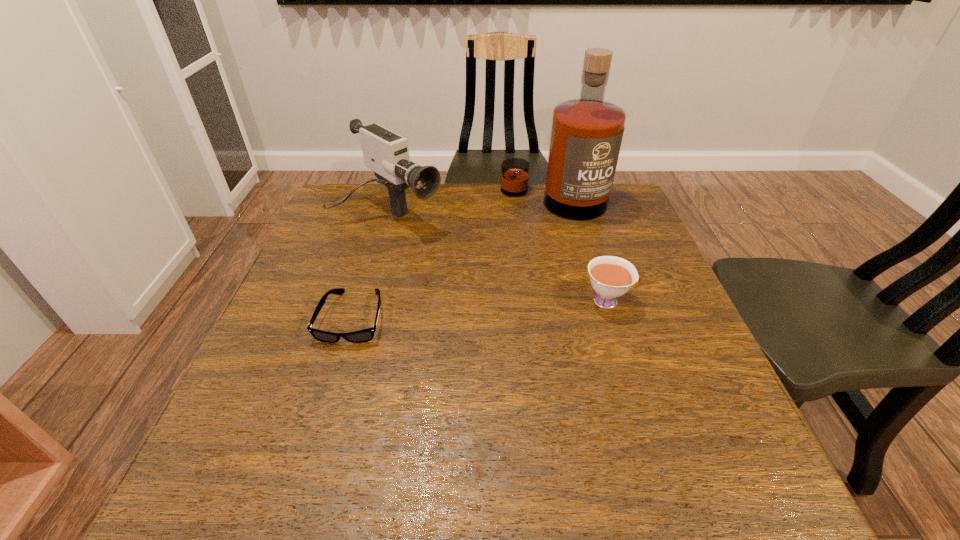
You are a GUI agent. You are given a task and a screenshot of the screen. Output one action in this format:
    pyautogui.click(x=<x>, y=<y>)
    Task: Click on the vacant area situated 0.070m on the front label of the tallest object
    This screenshot has width=960, height=540.
    Given the screenshot: What is the action you would take?
    pyautogui.click(x=536, y=234)

This screenshot has width=960, height=540. In order to click on vacant space situated 0.090m on the front label of the tallest object in this screenshot , I will do `click(535, 239)`.

This screenshot has height=540, width=960. In order to click on camcorder that is at the far edge in this screenshot , I will do `click(386, 153)`.

Find the location of a particular element. This screenshot has width=960, height=540. liquor at the far edge is located at coordinates (586, 134).

The width and height of the screenshot is (960, 540). Identify the location of sunglasses situated at the left edge. (365, 335).

Locate an element on the screen. The height and width of the screenshot is (540, 960). camcorder that is positioned at the left edge is located at coordinates (386, 153).

At what (x,y) coordinates should I click in order to perform the action: click on teacup at the right edge. Please return your answer as a coordinate pair (x, y). The image size is (960, 540). Looking at the image, I should click on (611, 277).

Where is `liquor that is positioned at the right edge`? The image size is (960, 540). liquor that is positioned at the right edge is located at coordinates (586, 134).

Image resolution: width=960 pixels, height=540 pixels. I want to click on object present at the far left corner, so click(x=386, y=153).

Find the location of `object positioned at the far right corner`. object positioned at the far right corner is located at coordinates (586, 134).